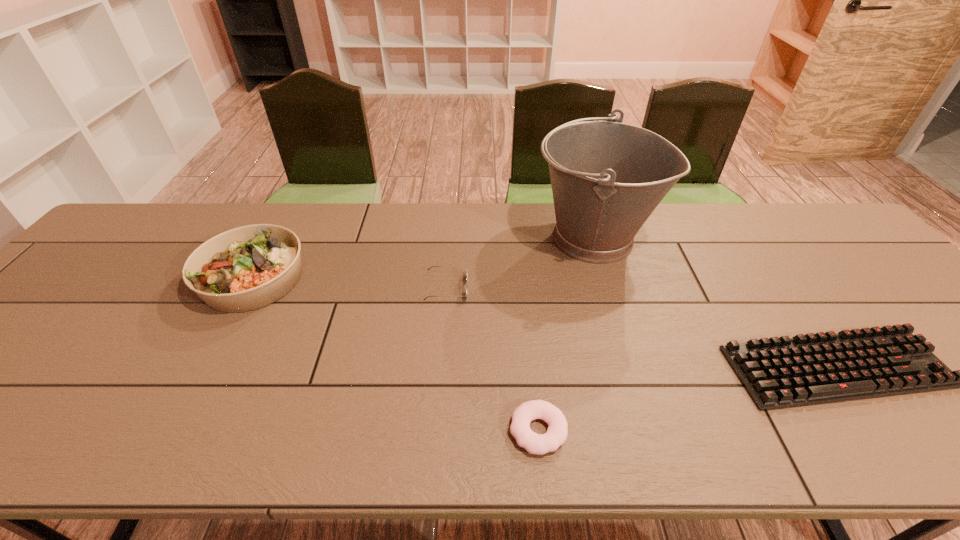
This screenshot has width=960, height=540. In order to click on vacant space that's between the sunglasses and the doughnut in this screenshot , I will do `click(492, 359)`.

In order to click on free space between the fourth shortest object and the doughnut in this screenshot , I will do `click(396, 354)`.

Where is `free space between the second tallest object and the doughnut`? The width and height of the screenshot is (960, 540). free space between the second tallest object and the doughnut is located at coordinates (396, 354).

The width and height of the screenshot is (960, 540). Find the location of `vacant region between the tallest object and the third shortest object`. vacant region between the tallest object and the third shortest object is located at coordinates (519, 262).

Image resolution: width=960 pixels, height=540 pixels. Find the location of `free space that is in between the salad plate and the sunglasses`. free space that is in between the salad plate and the sunglasses is located at coordinates (349, 283).

Where is `vacant space that is in between the tallest object and the third shortest object`? This screenshot has height=540, width=960. vacant space that is in between the tallest object and the third shortest object is located at coordinates (519, 262).

Locate which object ranks third in proximity to the computer keyboard. Please provide its 2D coordinates. Your answer should be formatted as a tuple, i.e. [(x, y)], where the tuple contains the x and y coordinates of a point satisfying the conditions above.

[(433, 266)]

At what (x,y) coordinates should I click in order to perform the action: click on object that is the fourth closest to the doughnut. Please return your answer as a coordinate pair (x, y). The width and height of the screenshot is (960, 540). Looking at the image, I should click on (249, 267).